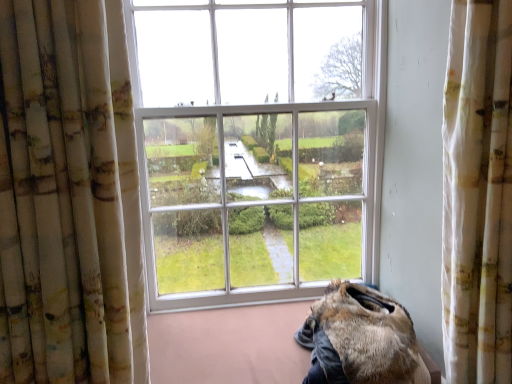
Question: Is white textured curtain at right, marked as the second curtain in a left-to-right arrangement, taller than fuzzy brown fur at lower right?

Choices:
 (A) yes
 (B) no

Answer: (A)

Question: From the image's perspective, is white textured curtain at right, marked as the second curtain in a left-to-right arrangement, beneath fuzzy brown fur at lower right?

Choices:
 (A) yes
 (B) no

Answer: (B)

Question: Does white textured curtain at right, marked as the second curtain in a left-to-right arrangement, touch fuzzy brown fur at lower right?

Choices:
 (A) no
 (B) yes

Answer: (A)

Question: Would you say white textured curtain at right, acting as the 1th curtain starting from the right, contains fuzzy brown fur at lower right?

Choices:
 (A) no
 (B) yes

Answer: (A)

Question: Can you confirm if white textured curtain at right, marked as the second curtain in a left-to-right arrangement, is positioned to the left of fuzzy brown fur at lower right?

Choices:
 (A) yes
 (B) no

Answer: (B)

Question: From a real-world perspective, is white textured curtain at right, marked as the second curtain in a left-to-right arrangement, over fuzzy brown fur at lower right?

Choices:
 (A) no
 (B) yes

Answer: (B)

Question: Is white textured curtain at right, acting as the 1th curtain starting from the right, shorter than white floral fabric curtain at left, which is counted as the first curtain, starting from the left?

Choices:
 (A) no
 (B) yes

Answer: (A)

Question: Is white textured curtain at right, acting as the 1th curtain starting from the right, facing towards white floral fabric curtain at left, arranged as the 2th curtain when viewed from the right?

Choices:
 (A) yes
 (B) no

Answer: (B)

Question: Considering the relative positions of white textured curtain at right, acting as the 1th curtain starting from the right, and white floral fabric curtain at left, arranged as the 2th curtain when viewed from the right, in the image provided, is white textured curtain at right, acting as the 1th curtain starting from the right, to the right of white floral fabric curtain at left, arranged as the 2th curtain when viewed from the right, from the viewer's perspective?

Choices:
 (A) no
 (B) yes

Answer: (B)

Question: From a real-world perspective, is white textured curtain at right, marked as the second curtain in a left-to-right arrangement, located higher than white floral fabric curtain at left, arranged as the 2th curtain when viewed from the right?

Choices:
 (A) no
 (B) yes

Answer: (A)

Question: Does white textured curtain at right, acting as the 1th curtain starting from the right, lie behind white floral fabric curtain at left, which is counted as the first curtain, starting from the left?

Choices:
 (A) yes
 (B) no

Answer: (A)

Question: Can we say white textured curtain at right, acting as the 1th curtain starting from the right, lies outside white floral fabric curtain at left, which is counted as the first curtain, starting from the left?

Choices:
 (A) yes
 (B) no

Answer: (A)

Question: Is fuzzy brown fur at lower right wider than white textured curtain at right, acting as the 1th curtain starting from the right?

Choices:
 (A) no
 (B) yes

Answer: (B)